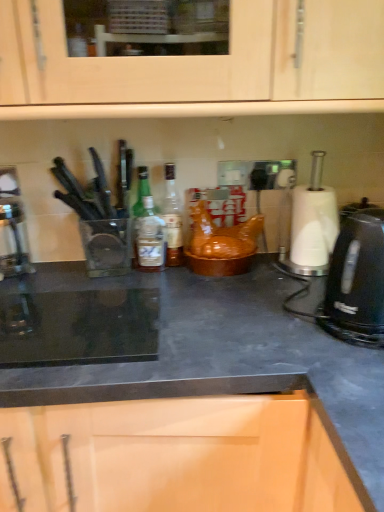
Where is `blank space situated above black matte countertop at center (from a real-world perspective)`? blank space situated above black matte countertop at center (from a real-world perspective) is located at coordinates (148, 302).